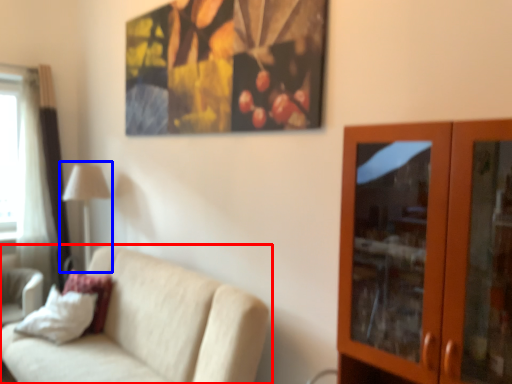
Question: Among these objects, which one is farthest to the camera, studio couch (highlighted by a red box) or table lamp (highlighted by a blue box)?

Choices:
 (A) studio couch
 (B) table lamp

Answer: (B)